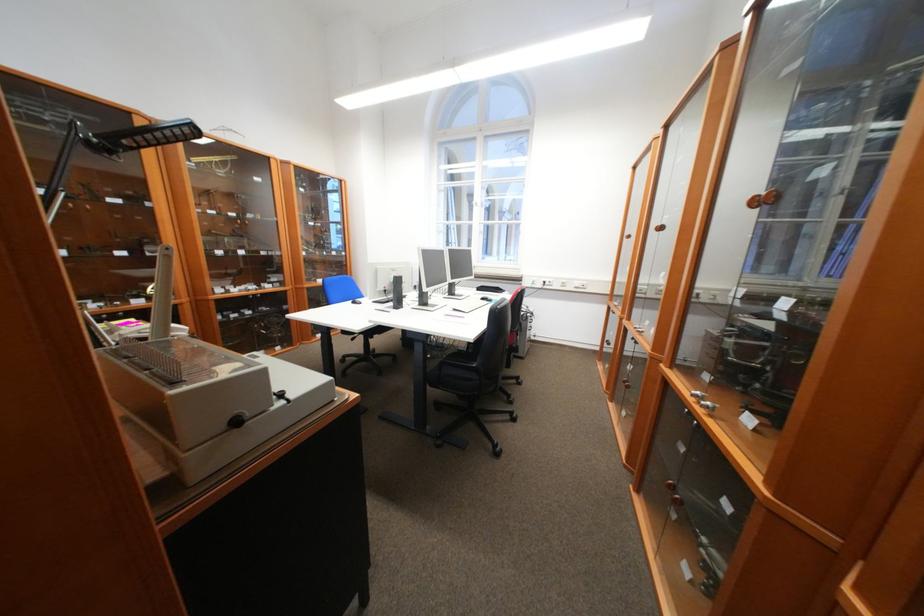
Find where to turn the black machine knob. Please return your answer as a coordinate pair (x, y).

(237, 419)